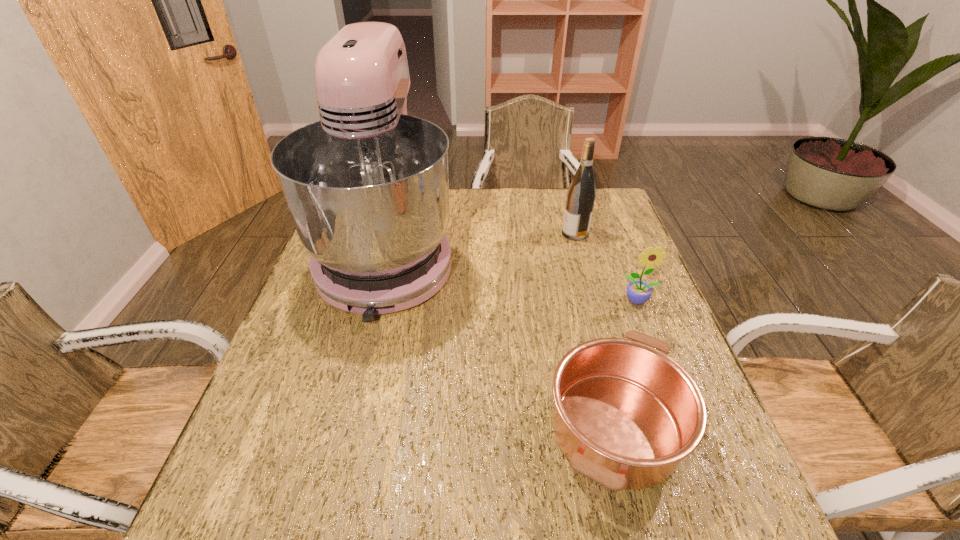
At what (x,y) coordinates should I click in order to perform the action: click on the leftmost object. Please return your answer as a coordinate pair (x, y). This screenshot has width=960, height=540. Looking at the image, I should click on (367, 186).

Where is `mixer`? mixer is located at coordinates (367, 186).

Where is `the third shortest object`? the third shortest object is located at coordinates (581, 194).

Where is `sunflower`? sunflower is located at coordinates (638, 292).

Find the location of a particular element. This screenshot has width=960, height=540. the shortest object is located at coordinates (625, 414).

The height and width of the screenshot is (540, 960). I want to click on saucepan, so click(x=625, y=414).

You are a GUI agent. You are given a task and a screenshot of the screen. Output one action in this format:
    pyautogui.click(x=<x>, y=<y>)
    Task: Click on the blank area located on the front-facing side of the mixer
    The width and height of the screenshot is (960, 540).
    Given the screenshot: What is the action you would take?
    pyautogui.click(x=331, y=481)

The height and width of the screenshot is (540, 960). What are the coordinates of `vacant space located on the back of the third shortest object` in the screenshot? It's located at [564, 192].

The image size is (960, 540). I want to click on free space located on the front-facing side of the sunflower, so click(x=697, y=453).

The image size is (960, 540). What are the coordinates of `blank space located on the left of the nearest object` in the screenshot? It's located at (481, 428).